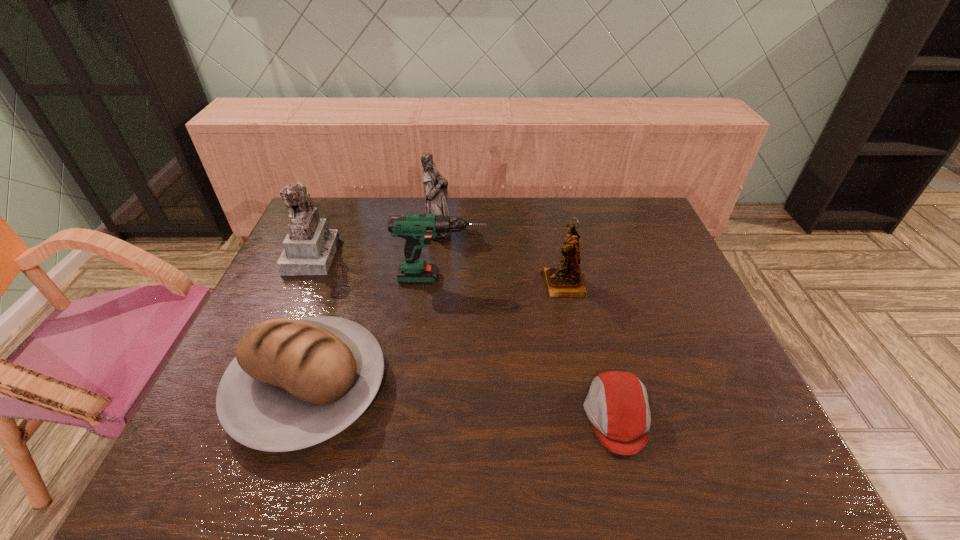
At what (x,y) coordinates should I click in order to perform the action: click on unoccupied area between the cap and the second figurine from right to left. Please return your answer as a coordinate pair (x, y). Looking at the image, I should click on (527, 322).

Locate an element on the screen. The height and width of the screenshot is (540, 960). empty location between the second shortest object and the shortest object is located at coordinates (463, 402).

Where is `free space between the leftmost figurine and the cap`? free space between the leftmost figurine and the cap is located at coordinates (465, 336).

This screenshot has width=960, height=540. In order to click on the closest object relative to the shortest figurine in this screenshot , I will do `click(417, 229)`.

Identify the location of the fifth closest object to the drill. This screenshot has height=540, width=960. tap(617, 405).

Select which figurine appears as the closest to the bread. Please provide its 2D coordinates. Your answer should be formatted as a tuple, i.e. [(x, y)], where the tuple contains the x and y coordinates of a point satisfying the conditions above.

[(309, 247)]

Identify the location of figurine object that ranks as the second closest to the shortest figurine. Image resolution: width=960 pixels, height=540 pixels. (309, 247).

The width and height of the screenshot is (960, 540). I want to click on vacant space that satisfies the following two spatial constraints: 1. on the front-facing side of the fifth tallest object; 2. on the left side of the leftmost figurine, so click(x=252, y=387).

I want to click on free space in the image that satisfies the following two spatial constraints: 1. on the front-facing side of the leftmost figurine; 2. on the left side of the bread, so click(252, 387).